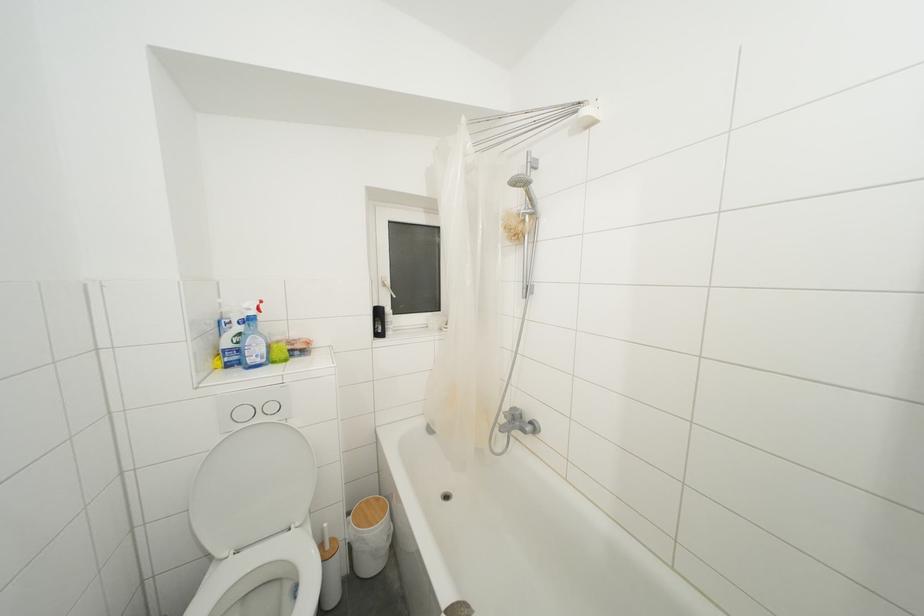
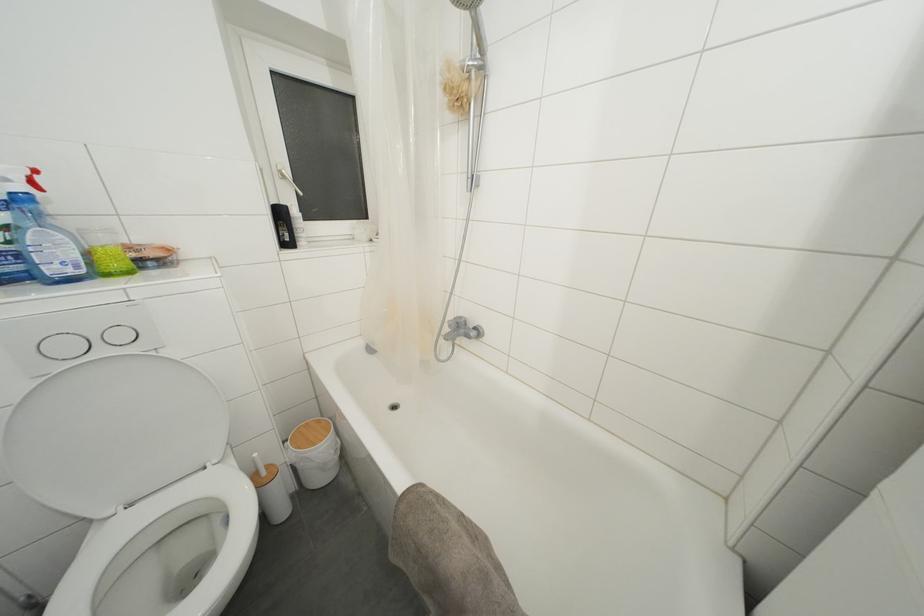
Find the pixel in the second image that matches point (532, 198) in the first image.

(480, 31)